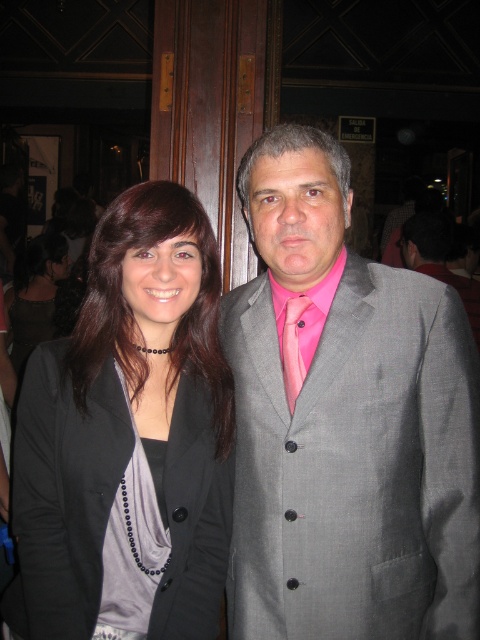
Measure the distance between point [193,202] and camera.

5.48 feet

Who is positioned more to the left, black matte blazer at center or gray suit at center?

black matte blazer at center is more to the left.

Describe the element at coordinates (128, 433) in the screenshot. I see `black matte blazer at center` at that location.

Where is `black matte blazer at center`? black matte blazer at center is located at coordinates (128, 433).

Which is below, matte gray suit at center or pink satin tie at center?

matte gray suit at center is below.

Can you confirm if matte gray suit at center is wider than pink satin tie at center?

Correct, the width of matte gray suit at center exceeds that of pink satin tie at center.

The image size is (480, 640). I want to click on matte gray suit at center, so click(x=346, y=422).

Locate an element on the screen. This screenshot has width=480, height=640. black matte blazer at center is located at coordinates (128, 433).

Can you confirm if black matte blazer at center is positioned below pink satin tie at center?

Yes.

Is point (204, 604) positioned behind point (294, 358)?

No, (204, 604) is in front of (294, 358).

The width and height of the screenshot is (480, 640). I want to click on black matte blazer at center, so click(128, 433).